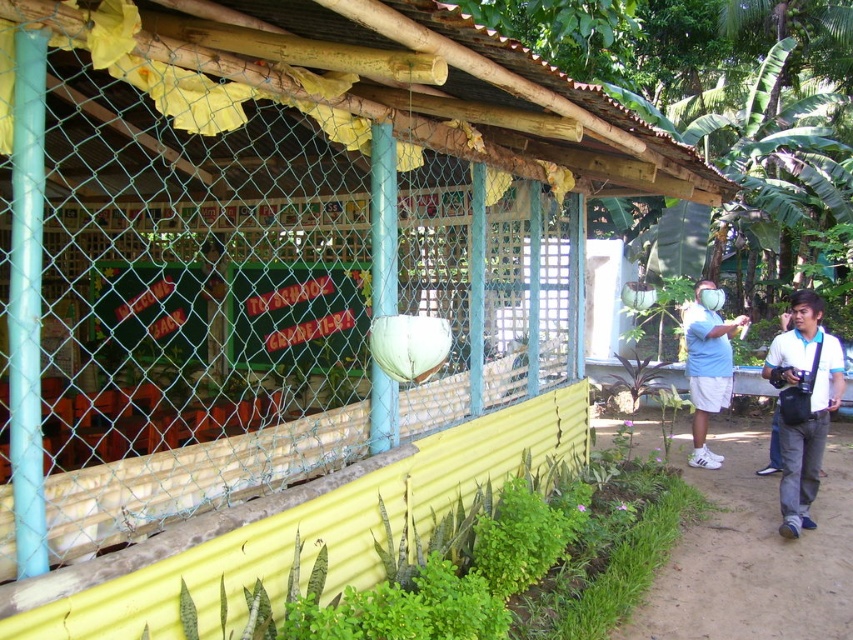
Does white cotton shirt at right have a greater width compared to white matte shirt at right?

No.

Does white cotton shirt at right have a larger size compared to white matte shirt at right?

Actually, white cotton shirt at right might be smaller than white matte shirt at right.

What do you see at coordinates (805, 403) in the screenshot?
I see `white cotton shirt at right` at bounding box center [805, 403].

Where is `white cotton shirt at right`? The height and width of the screenshot is (640, 853). white cotton shirt at right is located at coordinates pos(805,403).

Is point (793, 545) less distant than point (798, 308)?

Yes, it is.

Find the location of a particular element. This screenshot has width=853, height=640. brown dirt path at lower right is located at coordinates (755, 554).

Who is higher up, brown dirt path at lower right or white matte shirt at right?

white matte shirt at right

Who is more forward, (695, 476) or (711, 456)?

Point (695, 476) is more forward.

At what (x,y) coordinates should I click in order to perform the action: click on brown dirt path at lower right. Please return your answer as a coordinate pair (x, y). The image size is (853, 640). Looking at the image, I should click on [755, 554].